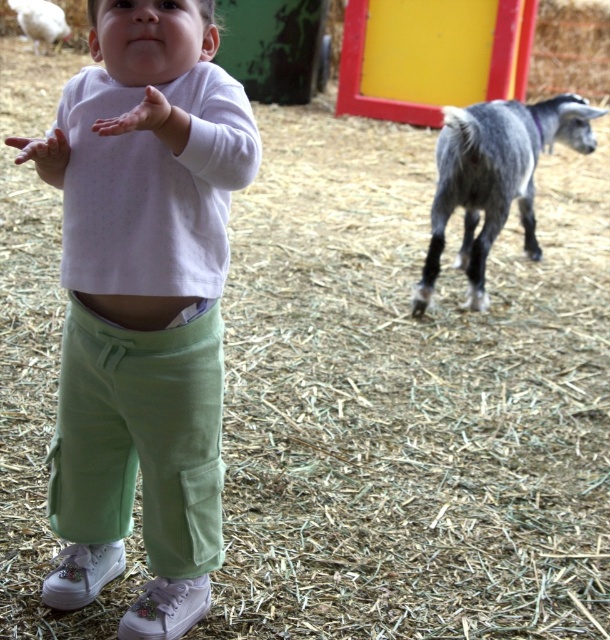
From the picture: Which is more to the left, light green cotton pants at center or gray woolen goat at right?

light green cotton pants at center

Between point (106, 13) and point (531, 140), which one is positioned in front?

Point (106, 13) is in front.

Who is more distant from viewer, (x=167, y=474) or (x=489, y=164)?

Positioned behind is point (x=489, y=164).

Where is `light green cotton pants at center`? This screenshot has width=610, height=640. light green cotton pants at center is located at coordinates (142, 304).

Does gray woolen goat at right appear on the left side of white fluffy sheep at upper left?

Incorrect, gray woolen goat at right is not on the left side of white fluffy sheep at upper left.

Between gray woolen goat at right and white fluffy sheep at upper left, which one appears on the left side from the viewer's perspective?

white fluffy sheep at upper left is more to the left.

At what (x,y) coordinates should I click in order to perform the action: click on gray woolen goat at right. Please return your answer as a coordinate pair (x, y). The width and height of the screenshot is (610, 640). Looking at the image, I should click on (493, 177).

Does light green cotton pants at center have a greater width compared to white fluffy sheep at upper left?

Correct, the width of light green cotton pants at center exceeds that of white fluffy sheep at upper left.

Consider the image. Can you confirm if light green cotton pants at center is taller than white fluffy sheep at upper left?

Correct, light green cotton pants at center is much taller as white fluffy sheep at upper left.

Does point (157, 412) come behind point (29, 36)?

That is False.

Image resolution: width=610 pixels, height=640 pixels. I want to click on light green cotton pants at center, so click(x=142, y=304).